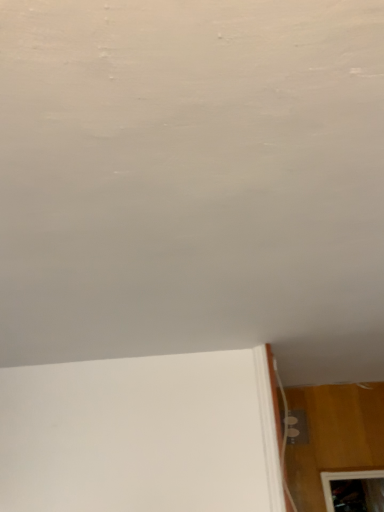
This screenshot has width=384, height=512. Describe the element at coordinates (193, 181) in the screenshot. I see `white matte wall at upper center` at that location.

Consider the image. What is the approximate width of white matte wall at upper center?

The width of white matte wall at upper center is 7.69 feet.

I want to click on white matte wall at upper center, so click(193, 181).

What is the approximate height of white glossy electric outlet at lower right?

white glossy electric outlet at lower right is 7.64 inches in height.

What do you see at coordinates (297, 426) in the screenshot? I see `white glossy electric outlet at lower right` at bounding box center [297, 426].

Where is `white glossy electric outlet at lower right`? white glossy electric outlet at lower right is located at coordinates (297, 426).

What is the approximate width of white glossy electric outlet at lower right?

white glossy electric outlet at lower right is 0.78 inches wide.

What are the coordinates of `white matte wall at upper center` in the screenshot? It's located at (193, 181).

Is white glossy electric outlet at lower right to the left or to the right of white matte wall at upper center in the image?

white glossy electric outlet at lower right is positioned on white matte wall at upper center's right side.

Which object is closer to the camera taking this photo, white glossy electric outlet at lower right or white matte wall at upper center?

white matte wall at upper center is more forward.

Which point is more forward, (300, 414) or (118, 70)?

The point (118, 70) is closer to the camera.

From the image's perspective, would you say white glossy electric outlet at lower right is shown under white matte wall at upper center?

Correct, white glossy electric outlet at lower right appears lower than white matte wall at upper center in the image.

From a real-world perspective, which object stands above the other?

white matte wall at upper center, from a real-world perspective.

Which object is wider, white glossy electric outlet at lower right or white matte wall at upper center?

With larger width is white matte wall at upper center.

From the picture: In terms of height, does white glossy electric outlet at lower right look taller or shorter compared to white matte wall at upper center?

white glossy electric outlet at lower right is taller than white matte wall at upper center.

Between white glossy electric outlet at lower right and white matte wall at upper center, which one has larger size?

With larger size is white matte wall at upper center.

Is white glossy electric outlet at lower right situated inside white matte wall at upper center or outside?

white glossy electric outlet at lower right is not enclosed by white matte wall at upper center.

Can you see white glossy electric outlet at lower right touching white matte wall at upper center?

No, white glossy electric outlet at lower right is not touching white matte wall at upper center.

Is white glossy electric outlet at lower right aimed at white matte wall at upper center?

Yes.

Locate an element on the screen. This screenshot has width=384, height=512. electric outlet on the right of white matte wall at upper center is located at coordinates (297, 426).

Is white matte wall at upper center at the right side of white glossy electric outlet at lower right?

No.

In the scene shown: Is white matte wall at upper center in front of white glossy electric outlet at lower right?

Yes, it is.

Considering the points (248, 176) and (302, 431), which point is behind, point (248, 176) or point (302, 431)?

The point (302, 431) is more distant.

From the image's perspective, who appears lower, white matte wall at upper center or white glossy electric outlet at lower right?

white glossy electric outlet at lower right is shown below in the image.

From a real-world perspective, is white matte wall at upper center over white glossy electric outlet at lower right?

Yes.

In terms of width, does white matte wall at upper center look wider or thinner when compared to white glossy electric outlet at lower right?

white matte wall at upper center is wider than white glossy electric outlet at lower right.

Based on the photo, which of these two, white matte wall at upper center or white glossy electric outlet at lower right, stands taller?

With more height is white glossy electric outlet at lower right.

Can you confirm if white matte wall at upper center is bigger than white glossy electric outlet at lower right?

Yes.

Is white matte wall at upper center surrounding white glossy electric outlet at lower right?

No, white glossy electric outlet at lower right is not inside white matte wall at upper center.

In the scene shown: Does white matte wall at upper center touch white glossy electric outlet at lower right?

They are not placed beside each other.

Is white glossy electric outlet at lower right at the back of white matte wall at upper center?

No, white matte wall at upper center's orientation is not away from white glossy electric outlet at lower right.

How far apart are white matte wall at upper center and white glossy electric outlet at lower right?

They are 5.33 feet apart.

Identify the location of electric outlet behind the white matte wall at upper center. (297, 426).

At what (x,y) coordinates should I click in order to perform the action: click on electric outlet below the white matte wall at upper center (from a real-world perspective). Please return your answer as a coordinate pair (x, y). Looking at the image, I should click on (x=297, y=426).

I want to click on backdrop on the left of white glossy electric outlet at lower right, so click(x=193, y=181).